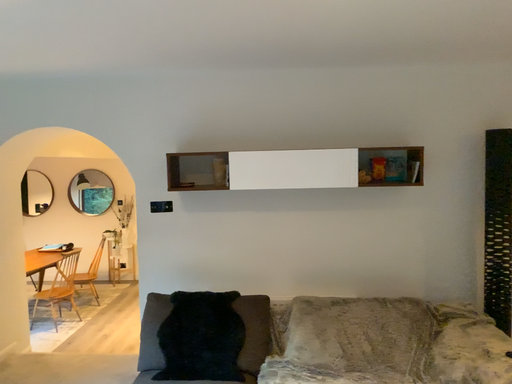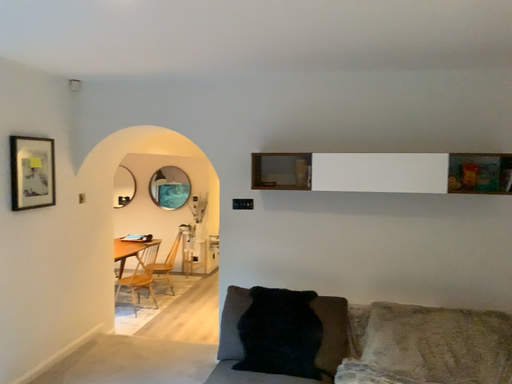
Question: How did the camera likely rotate when shooting the video?

Choices:
 (A) rotated right
 (B) rotated left

Answer: (B)